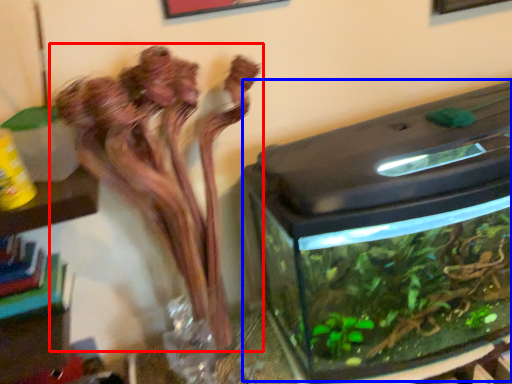
Question: Which point is closer to the camera, houseplant (highlighted by a red box) or water tank (highlighted by a blue box)?

Choices:
 (A) houseplant
 (B) water tank

Answer: (A)